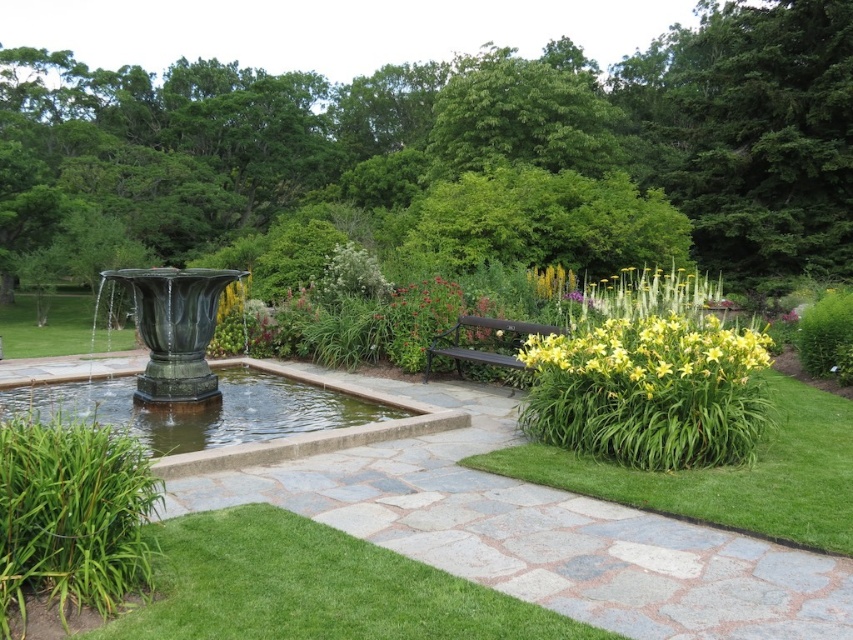
Which is behind, point (196, 554) or point (155, 394)?

The point (155, 394) is behind.

From the picture: Does green grass at lower left lie in front of green polished stone fountain at left?

Yes, green grass at lower left is closer to the viewer.

Locate an element on the screen. The height and width of the screenshot is (640, 853). green grass at lower left is located at coordinates (312, 588).

Which is more to the right, green grass at lower left or black metal bench at center?

black metal bench at center

Does green grass at lower left come in front of black metal bench at center?

Yes.

Is point (224, 595) positioned after point (541, 330)?

No, (224, 595) is closer to viewer.

Find the location of a particular element. This screenshot has width=853, height=640. green grass at lower left is located at coordinates (312, 588).

Who is more distant from viewer, (x=709, y=520) or (x=198, y=436)?

The point (x=198, y=436) is behind.

Where is `green leafy grass at center right`? green leafy grass at center right is located at coordinates (727, 476).

The width and height of the screenshot is (853, 640). I want to click on green leafy grass at center right, so [727, 476].